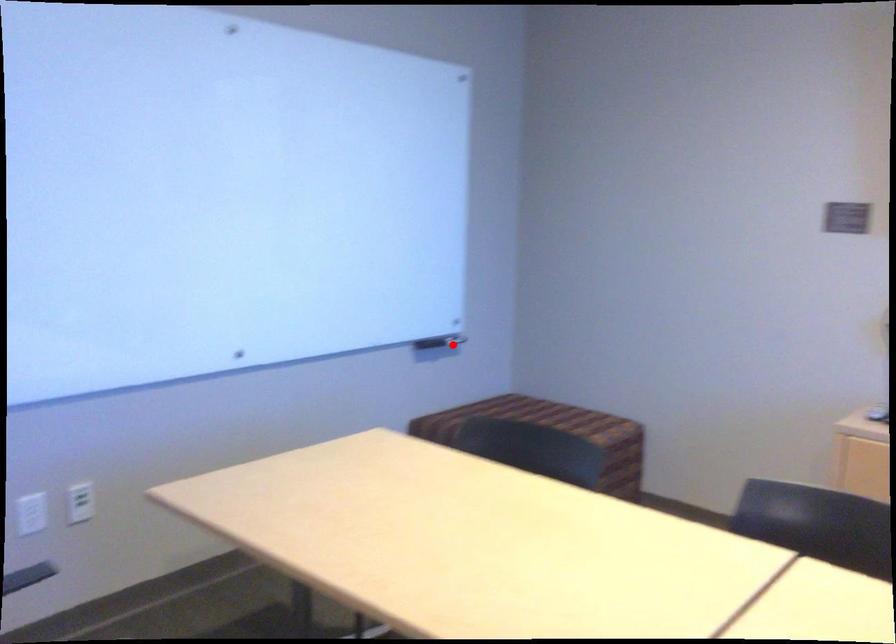
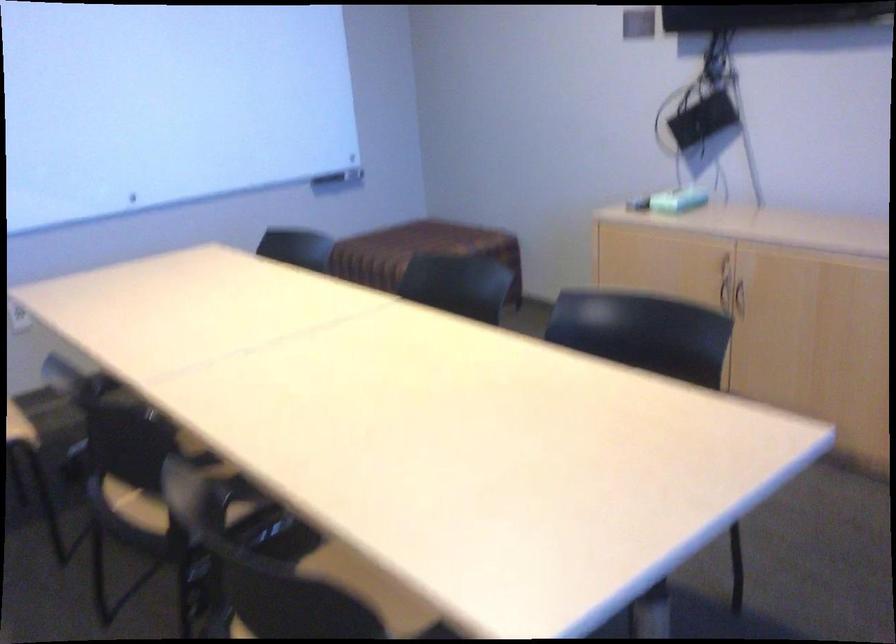
Question: I am providing you with two images of the same scene from different viewpoints. Image1 has a red point marked. In image2, the corresponding 3D location appears at what relative position? Reply with the corresponding letter.

Choices:
 (A) Closer
 (B) Farther

Answer: (B)